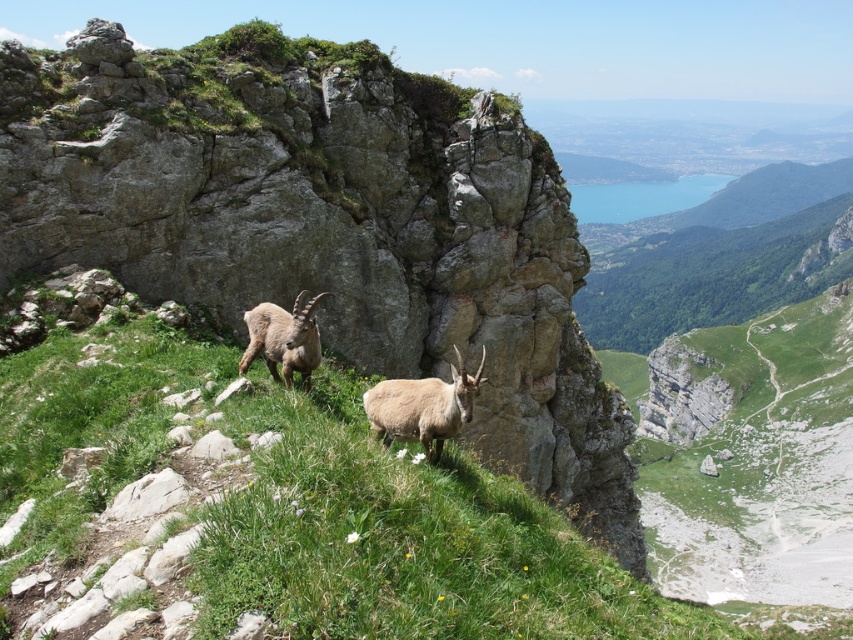
You are a hiker trying to identify animals in the distance. You see a light brown woolen ram at center and a light brown woolen goat at center. Which animal is shorter?

The light brown woolen ram at center is shorter than the light brown woolen goat at center.

You are a hiker trying to navigate the rugged terrain. You see the light brown woolen ram at center. Based on its position, can you determine if it is closer to the steep cliff face or the valley below?

The light brown woolen ram at center is located at point coordinates that place it closer to the steep cliff face in the foreground rather than the valley in the middle ground. Since the cliff is in the foreground and the valley is further back, the ram is nearer to the cliff.